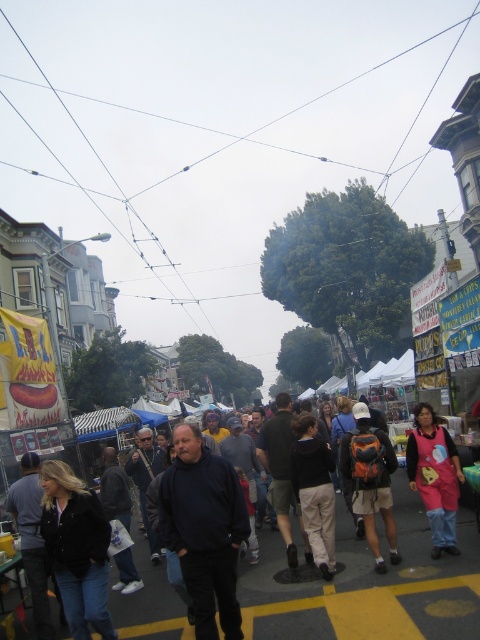
Can you confirm if dark blue sweatshirt at center is thinner than pink fabric costume at lower right?

Incorrect, dark blue sweatshirt at center's width is not less than pink fabric costume at lower right's.

Is dark blue sweatshirt at center wider than pink fabric costume at lower right?

Indeed, dark blue sweatshirt at center has a greater width compared to pink fabric costume at lower right.

Is point (410, 580) farther from camera compared to point (447, 509)?

No, it is in front of (447, 509).

This screenshot has width=480, height=640. Identify the location of dark blue sweatshirt at center. (368, 586).